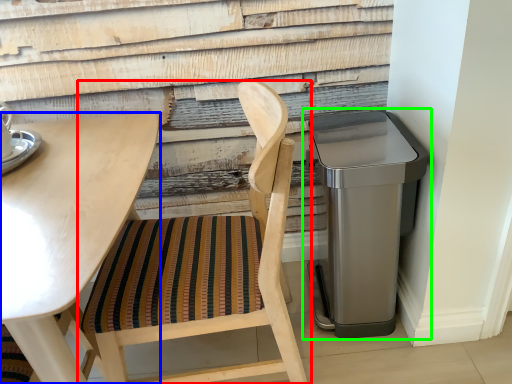
Question: Estimate the real-world distances between objects in this image. Which object is closer to chair (highlighted by a red box), table (highlighted by a blue box) or waste container (highlighted by a green box)?

Choices:
 (A) table
 (B) waste container

Answer: (A)